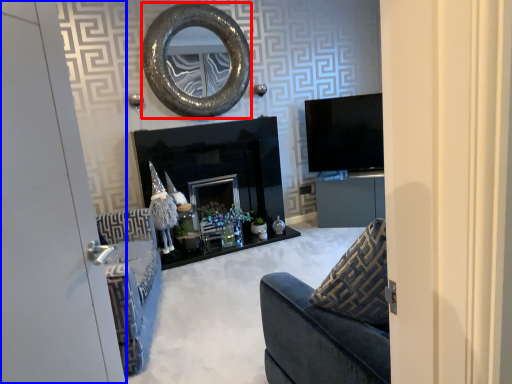
Question: Which object is closer to the camera taking this photo, oval (highlighted by a red box) or door (highlighted by a blue box)?

Choices:
 (A) oval
 (B) door

Answer: (B)